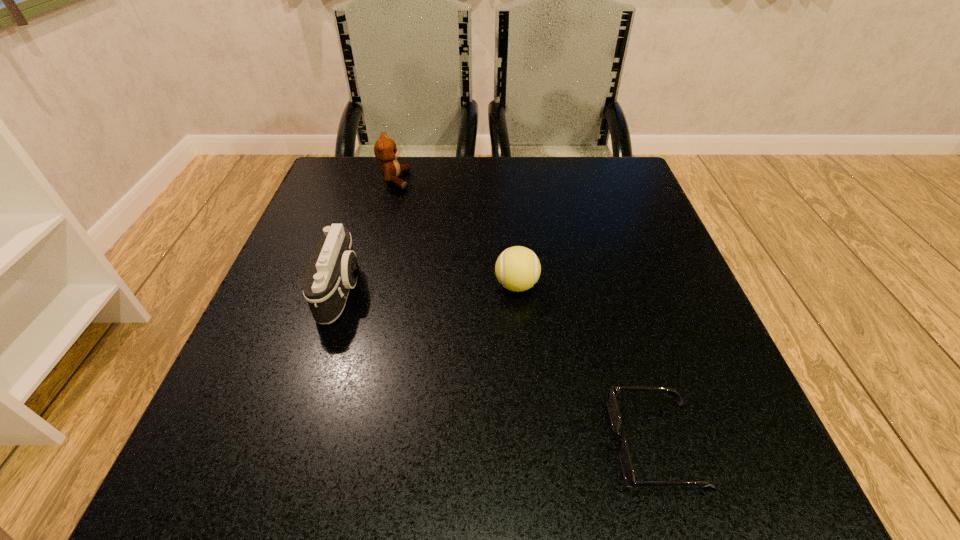
At what (x,y) coordinates should I click in order to perform the action: click on blank space at the near edge. Please return your answer as a coordinate pair (x, y). Looking at the image, I should click on (456, 467).

In the image, there is a desktop. Identify the location of free space at the left edge. This screenshot has width=960, height=540. (357, 226).

In the image, there is a desktop. At what (x,y) coordinates should I click in order to perform the action: click on blank space at the right edge. Please return your answer as a coordinate pair (x, y). Looking at the image, I should click on (615, 231).

Where is `free location at the far left corner of the desktop`? free location at the far left corner of the desktop is located at coordinates (310, 207).

Find the location of a particular element. This screenshot has height=540, width=960. vacant region at the far right corner of the desktop is located at coordinates coord(615,176).

What are the coordinates of `free space between the camera and the rightmost object` in the screenshot? It's located at (499, 367).

You are a GUI agent. You are given a task and a screenshot of the screen. Output one action in this format:
    pyautogui.click(x=<x>, y=<y>)
    Task: Click on the vacant area between the shortest object and the camera
    
    Given the screenshot: What is the action you would take?
    pyautogui.click(x=499, y=367)

In order to click on vacant point located between the second shortest object and the shortest object in this screenshot , I will do point(587,364).

Locate an element on the screen. This screenshot has width=960, height=540. free spot between the third tallest object and the nearest object is located at coordinates (587, 364).

I want to click on vacant space that is in between the tennis ball and the camera, so click(x=429, y=288).